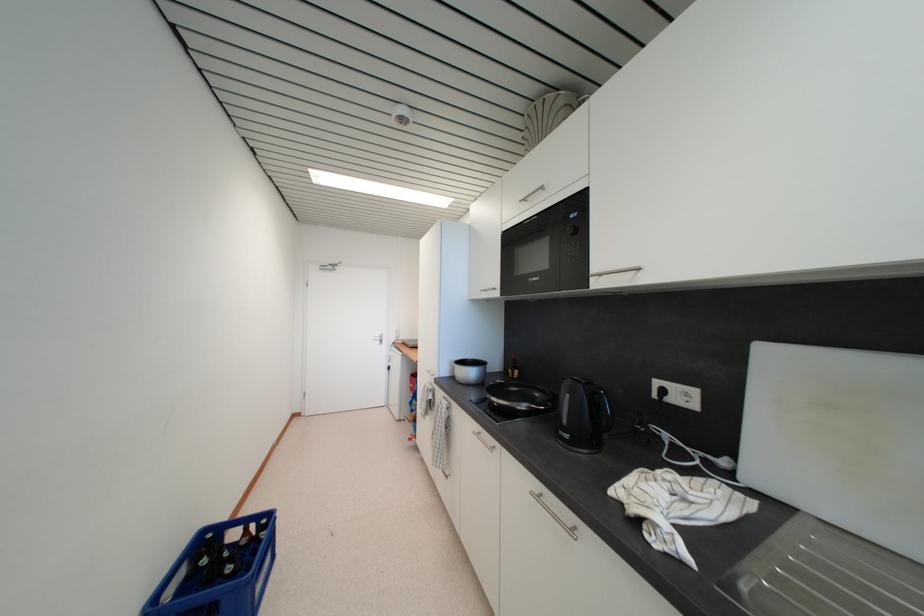
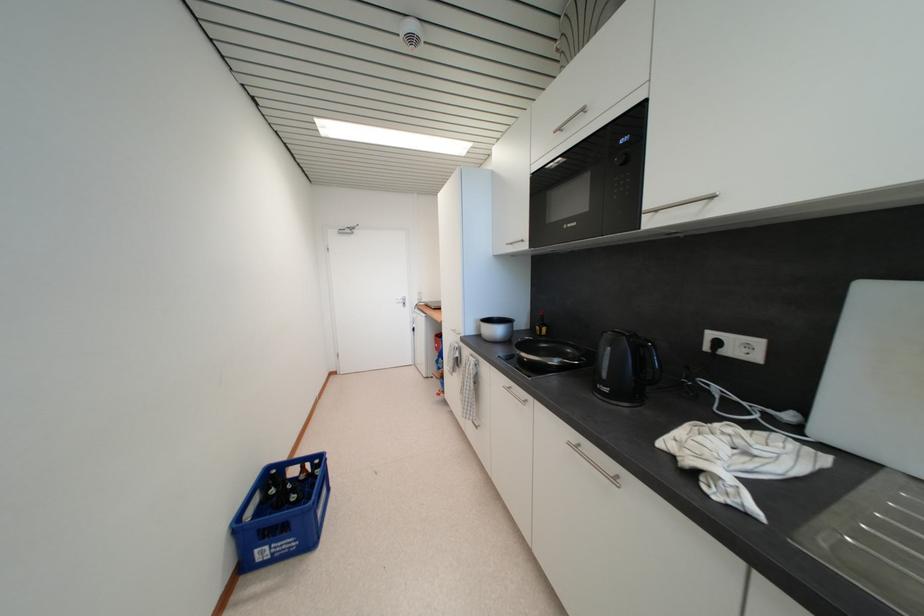
Question: The images are taken continuously from a first-person perspective. In which direction is your viewpoint rotating?

Choices:
 (A) Left
 (B) Right
 (C) Up
 (D) Down

Answer: (D)